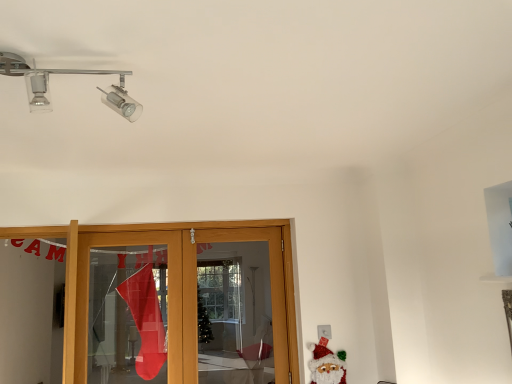
Question: From the image's perspective, would you say chrome/metallic track lighting at upper left is shown under felt santa claus at lower right?

Choices:
 (A) yes
 (B) no

Answer: (B)

Question: Could you tell me if chrome/metallic track lighting at upper left is turned towards felt santa claus at lower right?

Choices:
 (A) no
 (B) yes

Answer: (A)

Question: Considering the relative sizes of chrome/metallic track lighting at upper left and felt santa claus at lower right in the image provided, is chrome/metallic track lighting at upper left taller than felt santa claus at lower right?

Choices:
 (A) yes
 (B) no

Answer: (B)

Question: Is chrome/metallic track lighting at upper left beside felt santa claus at lower right?

Choices:
 (A) yes
 (B) no

Answer: (B)

Question: Considering the relative positions of chrome/metallic track lighting at upper left and felt santa claus at lower right in the image provided, is chrome/metallic track lighting at upper left in front of felt santa claus at lower right?

Choices:
 (A) yes
 (B) no

Answer: (A)

Question: Is felt santa claus at lower right completely or partially inside chrome/metallic track lighting at upper left?

Choices:
 (A) yes
 (B) no

Answer: (B)

Question: Is felt santa claus at lower right positioned beyond the bounds of chrome/metallic track lighting at upper left?

Choices:
 (A) no
 (B) yes

Answer: (B)

Question: Is felt santa claus at lower right not near chrome/metallic track lighting at upper left?

Choices:
 (A) yes
 (B) no

Answer: (A)

Question: Is felt santa claus at lower right bigger than chrome/metallic track lighting at upper left?

Choices:
 (A) yes
 (B) no

Answer: (B)

Question: Is felt santa claus at lower right wider than chrome/metallic track lighting at upper left?

Choices:
 (A) no
 (B) yes

Answer: (A)

Question: From a real-world perspective, is felt santa claus at lower right located higher than chrome/metallic track lighting at upper left?

Choices:
 (A) yes
 (B) no

Answer: (B)

Question: Is felt santa claus at lower right closer to the viewer compared to chrome/metallic track lighting at upper left?

Choices:
 (A) yes
 (B) no

Answer: (B)

Question: In terms of width, does felt santa claus at lower right look wider or thinner when compared to chrome/metallic track lighting at upper left?

Choices:
 (A) thin
 (B) wide

Answer: (A)